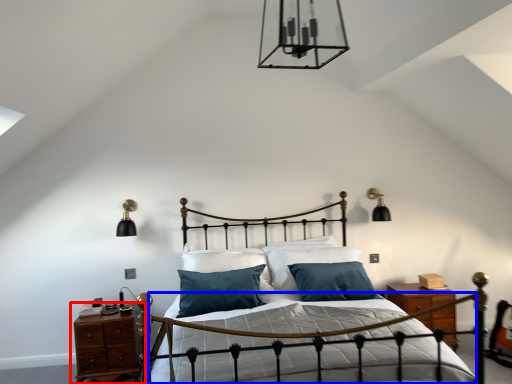
Question: Which point is closer to the camera, nightstand (highlighted by a red box) or bed frame (highlighted by a blue box)?

Choices:
 (A) nightstand
 (B) bed frame

Answer: (B)